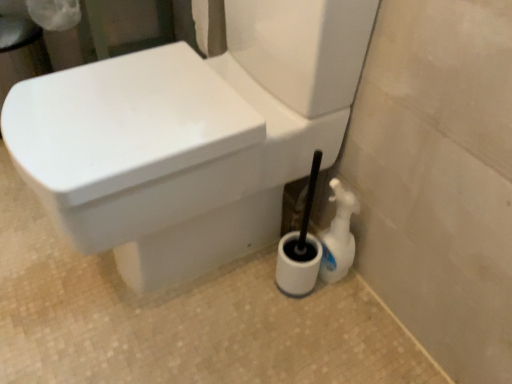
What do you see at coordinates (191, 136) in the screenshot?
I see `white glossy toilet at center` at bounding box center [191, 136].

Locate an element on the screen. The height and width of the screenshot is (384, 512). white glossy toilet at center is located at coordinates (191, 136).

Image resolution: width=512 pixels, height=384 pixels. I want to click on white plastic spray bottle at lower right, so click(x=338, y=235).

Image resolution: width=512 pixels, height=384 pixels. Describe the element at coordinates (338, 235) in the screenshot. I see `white plastic spray bottle at lower right` at that location.

Find the location of a particular element. white glossy toilet at center is located at coordinates (191, 136).

Considering the positions of objects white glossy toilet at center and white plastic spray bottle at lower right in the image provided, who is more to the right, white glossy toilet at center or white plastic spray bottle at lower right?

From the viewer's perspective, white plastic spray bottle at lower right appears more on the right side.

Which object is further away from the camera, white glossy toilet at center or white plastic spray bottle at lower right?

white plastic spray bottle at lower right is further from the camera.

Is point (248, 26) closer to viewer compared to point (325, 232)?

Yes, point (248, 26) is in front of point (325, 232).

From the image's perspective, which one is positioned lower, white glossy toilet at center or white plastic spray bottle at lower right?

white plastic spray bottle at lower right appears lower in the image.

From a real-world perspective, is white glossy toilet at center located beneath white plastic spray bottle at lower right?

No, from a real-world perspective, white glossy toilet at center is not beneath white plastic spray bottle at lower right.

Considering the sizes of white glossy toilet at center and white plastic spray bottle at lower right in the image, is white glossy toilet at center wider or thinner than white plastic spray bottle at lower right?

In the image, white glossy toilet at center appears to be wider than white plastic spray bottle at lower right.

Considering the sizes of white glossy toilet at center and white plastic spray bottle at lower right in the image, is white glossy toilet at center taller or shorter than white plastic spray bottle at lower right?

Clearly, white glossy toilet at center is taller compared to white plastic spray bottle at lower right.

Based on the photo, looking at the image, does white glossy toilet at center seem bigger or smaller compared to white plastic spray bottle at lower right?

Considering their sizes, white glossy toilet at center takes up more space than white plastic spray bottle at lower right.

Is white plastic spray bottle at lower right inside white glossy toilet at center?

No, white plastic spray bottle at lower right is not inside white glossy toilet at center.

Is white glossy toilet at center not near white plastic spray bottle at lower right?

No, white glossy toilet at center is in close proximity to white plastic spray bottle at lower right.

Could you tell me if white glossy toilet at center is facing white plastic spray bottle at lower right?

No, white glossy toilet at center is not aimed at white plastic spray bottle at lower right.

Looking at this image, can you tell me how much white glossy toilet at center and white plastic spray bottle at lower right differ in facing direction?

They differ by 0.31 degrees in their facing directions.

In the image, there is a white glossy toilet at center. In order to click on cleaning product below it (from the image's perspective) in this screenshot , I will do `click(338, 235)`.

Is white plastic spray bottle at lower right at the left side of white glossy toilet at center?

Incorrect, white plastic spray bottle at lower right is not on the left side of white glossy toilet at center.

Which object is closer to the camera, white plastic spray bottle at lower right or white glossy toilet at center?

white glossy toilet at center is closer to the camera.

Is point (321, 261) positioned after point (254, 66)?

Yes, point (321, 261) is behind point (254, 66).

From the image's perspective, would you say white plastic spray bottle at lower right is positioned over white glossy toilet at center?

No, from the image's perspective, white plastic spray bottle at lower right is not on top of white glossy toilet at center.

From a real-world perspective, is white plastic spray bottle at lower right over white glossy toilet at center?

No, from a real-world perspective, white plastic spray bottle at lower right is not on top of white glossy toilet at center.

Which object is thinner, white plastic spray bottle at lower right or white glossy toilet at center?

Thinner between the two is white plastic spray bottle at lower right.

Can you confirm if white plastic spray bottle at lower right is shorter than white glossy toilet at center?

Indeed, white plastic spray bottle at lower right has a lesser height compared to white glossy toilet at center.

Looking at the image, does white plastic spray bottle at lower right seem bigger or smaller compared to white glossy toilet at center?

white plastic spray bottle at lower right is smaller than white glossy toilet at center.

Is white plastic spray bottle at lower right inside or outside of white glossy toilet at center?

white plastic spray bottle at lower right is not inside white glossy toilet at center, it's outside.

Are white plastic spray bottle at lower right and white glossy toilet at center making contact?

No, white plastic spray bottle at lower right is not making contact with white glossy toilet at center.

Is white plastic spray bottle at lower right aimed at white glossy toilet at center?

No, white plastic spray bottle at lower right is not turned towards white glossy toilet at center.

What's the angular difference between white plastic spray bottle at lower right and white glossy toilet at center's facing directions?

They differ by 0.31 degrees in their facing directions.

This screenshot has width=512, height=384. Find the location of `toilet on the left of white plastic spray bottle at lower right`. toilet on the left of white plastic spray bottle at lower right is located at coordinates (191, 136).

Find the location of `cleaning product below the white glossy toilet at center (from a real-world perspective)`. cleaning product below the white glossy toilet at center (from a real-world perspective) is located at coordinates (338, 235).

The image size is (512, 384). What are the coordinates of `cleaning product on the right of the white glossy toilet at center` in the screenshot? It's located at (338, 235).